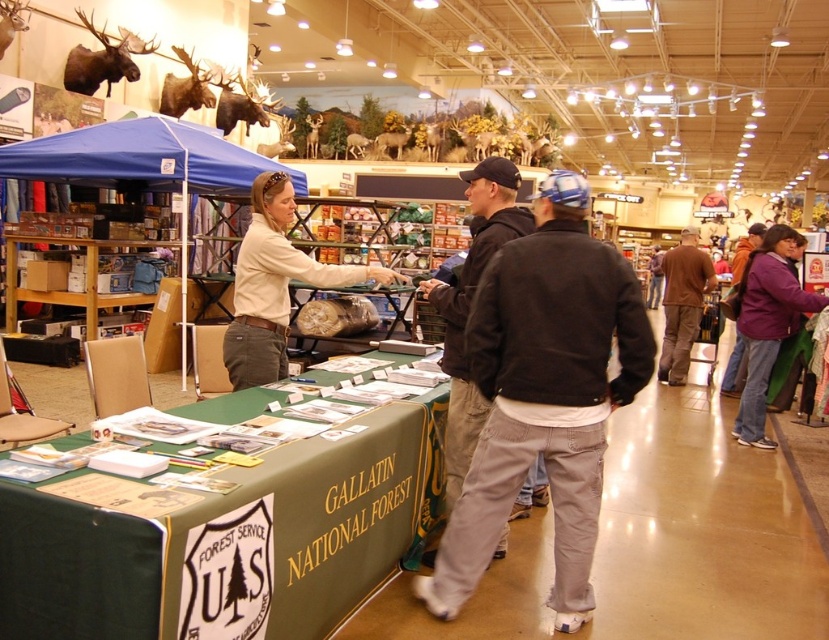
You are standing in front of the Gallatin National Forest booth and notice two points on the table. The first point is at coordinates (120, 120), and the second is at (490, 188). Which point is closer to you?

Point (120, 120) is closer to you because it is further to the camera than point (490, 188).

You are setting up a booth for an event and need to decide whether the green fabric table at center can fit under the blue fabric canopy at upper left. Based on the scene description, can the table fit under the canopy?

The green fabric table at center has a width less than the blue fabric canopy at upper left, so yes, the table can fit under the canopy as it is narrower.

You are standing at the Gallatin National Forest booth and want to know how far you are from the point marked at coordinates (x=238, y=192) on the table. Can you determine the distance?

The point at coordinates (x=238, y=192) is 9.26 meters away from you.